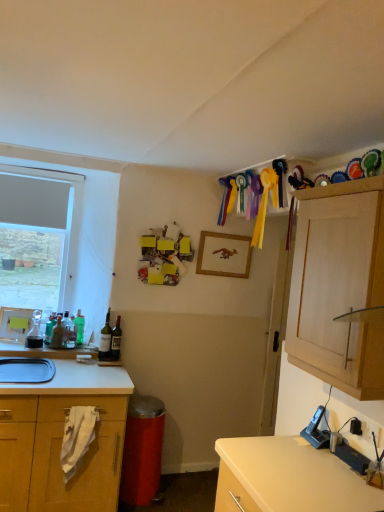
What are the coordinates of `vacant area that is in front of translucent glass bottle at left, acting as the fourth bottle starting from the right` in the screenshot? It's located at (55, 349).